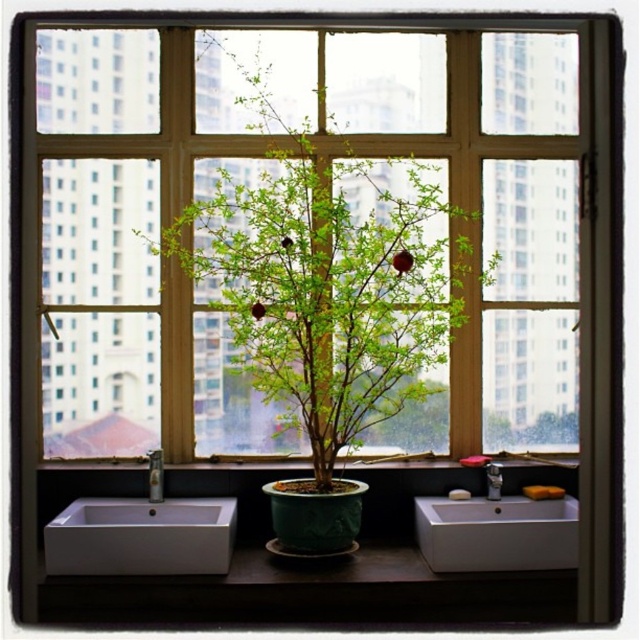
Question: In this image, where is white glossy sink at left located relative to white glossy sink at lower center?

Choices:
 (A) below
 (B) above

Answer: (B)

Question: Which object appears farthest from the camera in this image?

Choices:
 (A) white glossy sink at left
 (B) green ceramic plant at center
 (C) green ceramic pot at center

Answer: (B)

Question: Which object appears farthest from the camera in this image?

Choices:
 (A) brushed metal faucet at lower center
 (B) white glossy sink at lower center
 (C) white ceramic faucet at center
 (D) green ceramic pot at center

Answer: (D)

Question: In this image, where is white glossy sink at left located relative to green ceramic pot at center?

Choices:
 (A) below
 (B) above

Answer: (A)

Question: Observing the image, what is the correct spatial positioning of green ceramic plant at center in reference to brushed metal faucet at lower center?

Choices:
 (A) below
 (B) above

Answer: (B)

Question: Estimate the real-world distances between objects in this image. Which object is farther from the green ceramic pot at center?

Choices:
 (A) white ceramic faucet at center
 (B) brushed metal faucet at lower center
 (C) white glossy sink at lower center

Answer: (A)